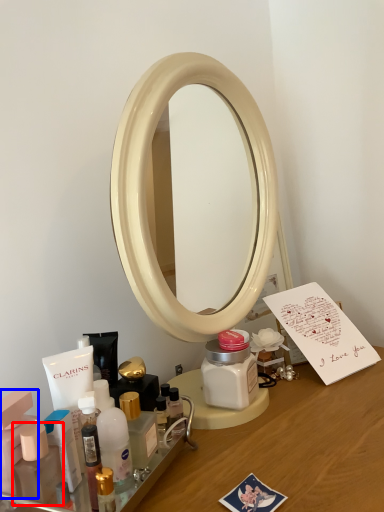
Question: Which of the following is the farthest to the observer, toiletry (highlighted by a red box) or toiletry (highlighted by a blue box)?

Choices:
 (A) toiletry
 (B) toiletry

Answer: (B)